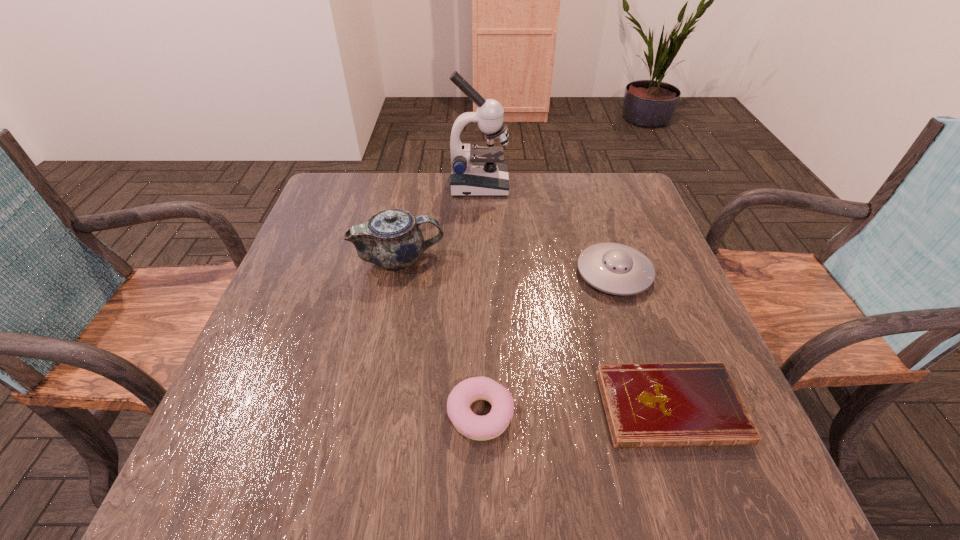
Where is `free region located 0.270m on the back of the shortest object`? The height and width of the screenshot is (540, 960). free region located 0.270m on the back of the shortest object is located at coordinates (625, 273).

Identify the location of object situated at the far edge. (478, 171).

Locate an element on the screen. Image resolution: width=960 pixels, height=540 pixels. doughnut located in the near edge section of the desktop is located at coordinates [x=475, y=427].

Where is `notebook at the near edge`? notebook at the near edge is located at coordinates (689, 404).

This screenshot has height=540, width=960. Find the location of `object present at the left edge`. object present at the left edge is located at coordinates (391, 239).

At what (x,y) coordinates should I click in order to perform the action: click on saucer present at the right edge. Please return your answer as a coordinate pair (x, y). Looking at the image, I should click on (614, 268).

Locate an element on the screen. This screenshot has width=960, height=540. notebook that is at the right edge is located at coordinates (689, 404).

Find the location of a particular element. The height and width of the screenshot is (540, 960). object situated at the near right corner is located at coordinates (689, 404).

Locate an element on the screen. This screenshot has width=960, height=540. blank space at the far edge is located at coordinates (412, 202).

The width and height of the screenshot is (960, 540). I want to click on vacant region at the near edge of the desktop, so click(x=337, y=500).